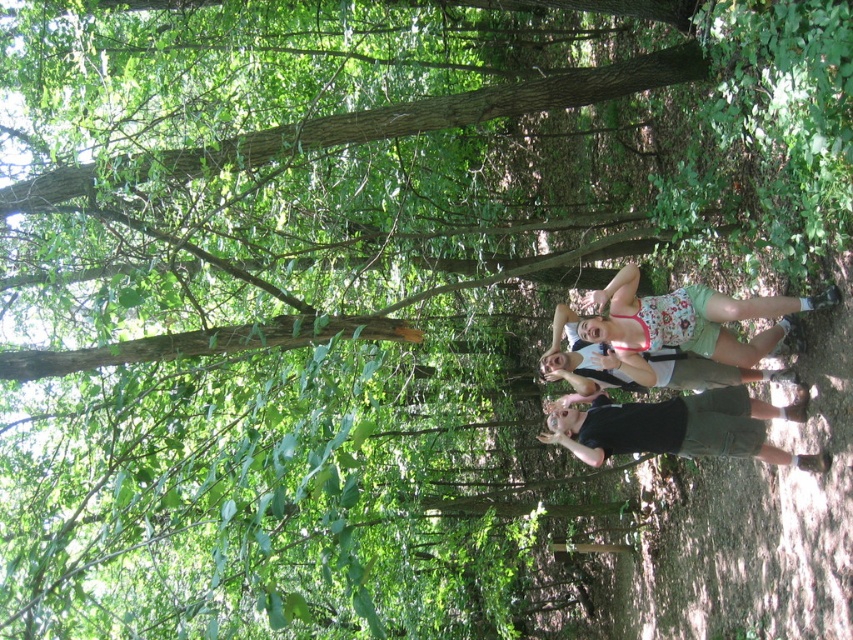
You are a photographer trying to capture a group shot of the four individuals in the wooded area. You notice the floral fabric shorts at center and the black matte shorts at lower right. Which pair of shorts is wider?

The black matte shorts at lower right is wider than the floral fabric shorts at center.

You are a photographer trying to capture a group photo of the four people in the wooded area. You notice the floral fabric shorts at center and the black matte shorts at lower right. Which of these two shorts is positioned higher in the image?

The floral fabric shorts at center is located above the black matte shorts at lower right, so it is positioned higher in the image.